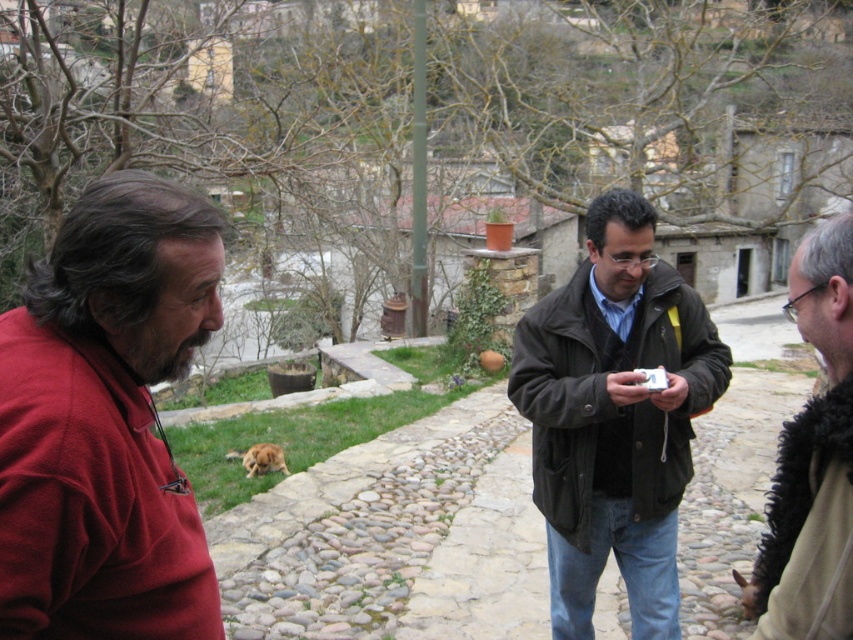
You are standing at the point with coordinates point (x=42, y=428) and want to walk towards the point with coordinates point (x=798, y=461). Which direction should you face to move directly towards your destination?

Since point (x=42, y=428) is in front of point (x=798, y=461), you should face backward to move directly towards point (x=798, y=461).

You are a fashion designer observing the scene. You need to determine which item of clothing is more suitable for a slim body type. Which one would you choose between the matte red shirt at left and the dark brown leather jacket at center?

The matte red shirt at left is thinner than the dark brown leather jacket at center, so the matte red shirt at left is more suitable for a slim body type.